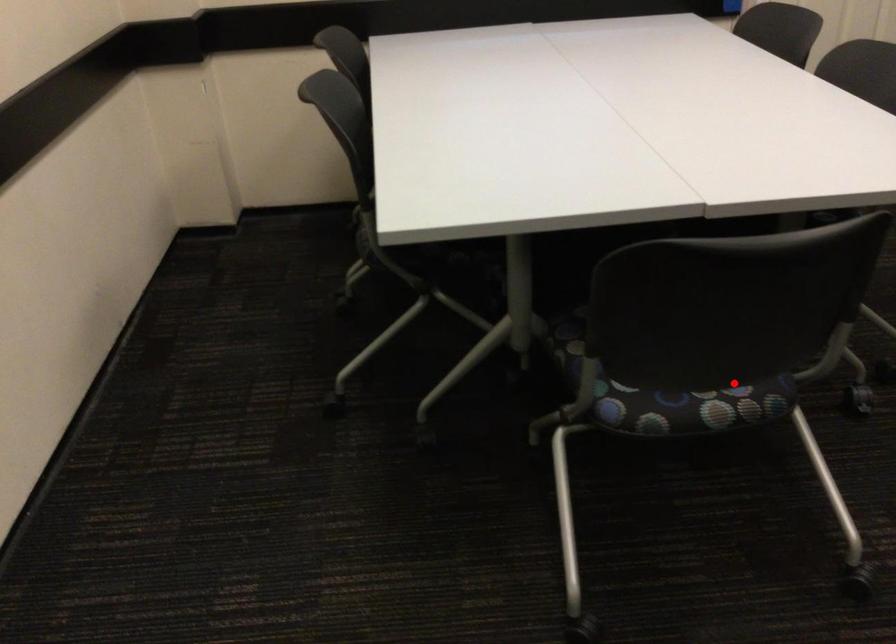
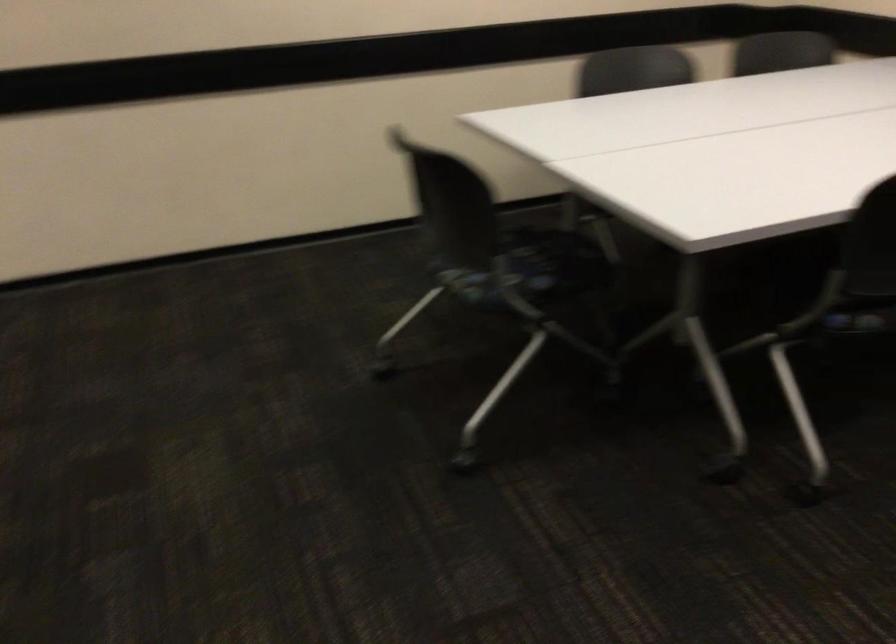
Question: I am providing you with two images of the same scene from different viewpoints. In image1, a red point is highlighted. Considering the same 3D point in image2, which of the following is correct?

Choices:
 (A) It is closer
 (B) It is farther

Answer: (B)